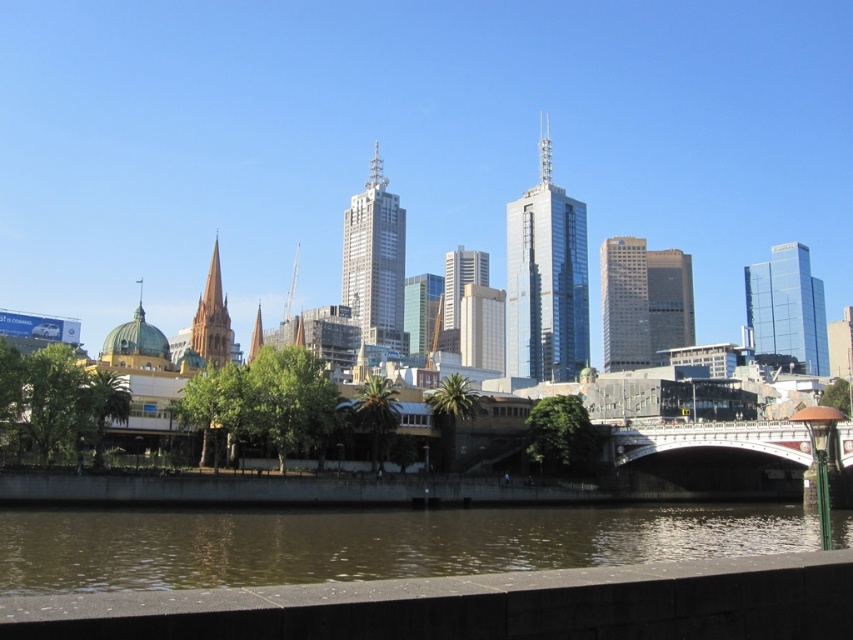
Can you confirm if brown concrete river at lower center is smaller than shiny glass skyscraper at center?

Correct, brown concrete river at lower center occupies less space than shiny glass skyscraper at center.

Describe the element at coordinates (367, 541) in the screenshot. The height and width of the screenshot is (640, 853). I see `brown concrete river at lower center` at that location.

At what (x,y) coordinates should I click in order to perform the action: click on brown concrete river at lower center. Please return your answer as a coordinate pair (x, y). Looking at the image, I should click on (367, 541).

Between shiny glass skyscraper at center and transparent glass skyscraper at upper right, which one is positioned lower?

transparent glass skyscraper at upper right

Is shiny glass skyscraper at center below transparent glass skyscraper at upper right?

No, shiny glass skyscraper at center is not below transparent glass skyscraper at upper right.

Between point (521, 285) and point (807, 276), which one is positioned in front?

Point (521, 285) is in front.

The image size is (853, 640). Identify the location of shiny glass skyscraper at center. (546, 278).

Can you confirm if transparent glass skyscraper at upper right is taller than matte glass skyscraper at center?

Yes, transparent glass skyscraper at upper right is taller than matte glass skyscraper at center.

Between point (792, 348) and point (622, 348), which one is positioned behind?

Point (792, 348)

Is point (759, 337) positioned in front of point (645, 340)?

No.

This screenshot has height=640, width=853. Identify the location of transparent glass skyscraper at upper right. (787, 307).